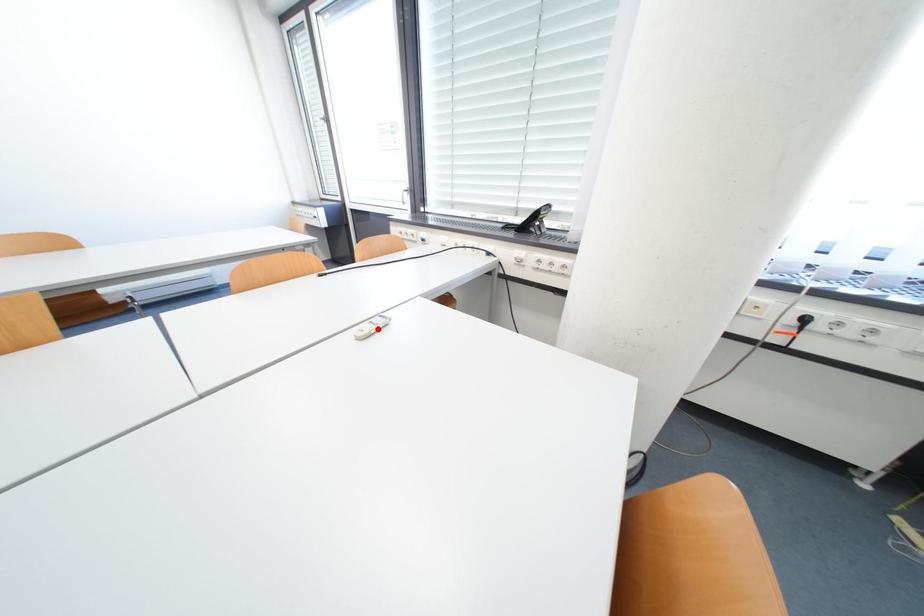
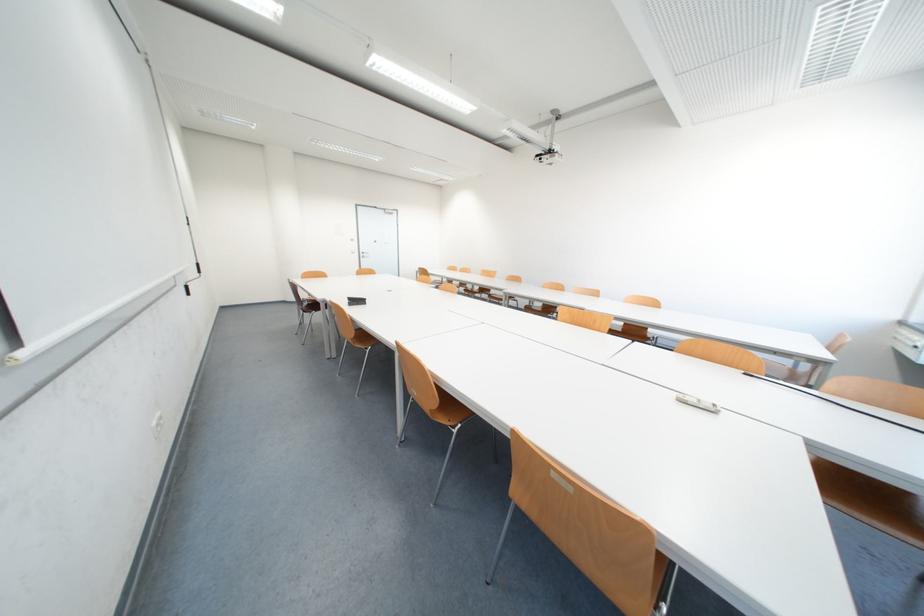
Find the pixel in the second image that matches the highlighted location in the first image.

(701, 400)